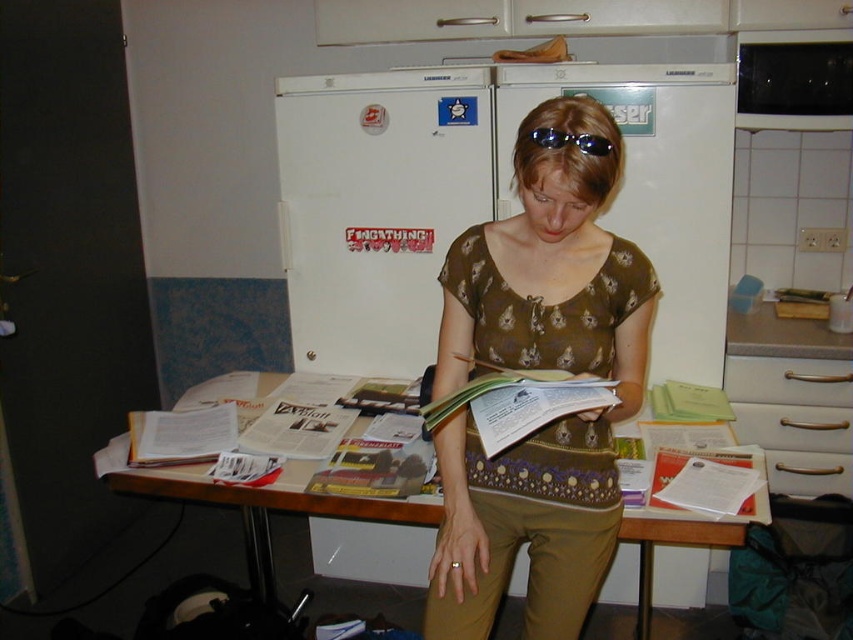
From the picture: You are a delivery person who needs to place a small package on the nearest surface to the viewer. You see the wooden table at center and the white matte drawer at lower right. Which surface should you choose?

The wooden table at center is closer to the viewer than the white matte drawer at lower right, so you should place the package on the wooden table at center.

You are a fashion designer observing the scene. You need to determine which item is higher in height between the brown printed shirt at center and the sunglasses at center. Which one is taller?

The brown printed shirt at center is taller than the sunglasses at center according to the description provided.

What is located at the point with coordinates (795, 419)?

The point with coordinates (795, 419) indicates the location of the silver metallic drawer at right.